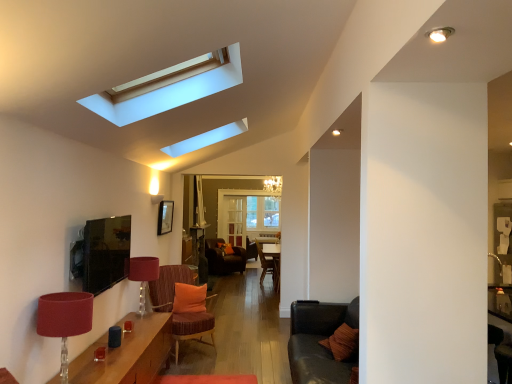
Question: Is velvet orange armchair at center positioned beyond the bounds of matte red lampshade at lower left, arranged as the second lamp when viewed from the front?

Choices:
 (A) yes
 (B) no

Answer: (A)

Question: From the image's perspective, is velvet orange armchair at center located beneath matte red lampshade at lower left, which ranks as the 1th lamp in back-to-front order?

Choices:
 (A) no
 (B) yes

Answer: (B)

Question: Considering the relative positions of velvet orange armchair at center and matte red lampshade at lower left, arranged as the second lamp when viewed from the front, in the image provided, is velvet orange armchair at center behind matte red lampshade at lower left, arranged as the second lamp when viewed from the front,?

Choices:
 (A) yes
 (B) no

Answer: (A)

Question: From a real-world perspective, is velvet orange armchair at center on top of matte red lampshade at lower left, which ranks as the 1th lamp in back-to-front order?

Choices:
 (A) no
 (B) yes

Answer: (A)

Question: Does velvet orange armchair at center have a lesser height compared to matte red lampshade at lower left, arranged as the second lamp when viewed from the front?

Choices:
 (A) yes
 (B) no

Answer: (B)

Question: Looking at their shapes, would you say textured brown couch at lower right is wider or thinner than velvet orange armchair at center?

Choices:
 (A) thin
 (B) wide

Answer: (A)

Question: In terms of size, does textured brown couch at lower right appear bigger or smaller than velvet orange armchair at center?

Choices:
 (A) small
 (B) big

Answer: (A)

Question: Is textured brown couch at lower right to the left or to the right of velvet orange armchair at center in the image?

Choices:
 (A) left
 (B) right

Answer: (B)

Question: From the image's perspective, is textured brown couch at lower right above or below velvet orange armchair at center?

Choices:
 (A) above
 (B) below

Answer: (A)

Question: In terms of width, does velvet orange armchair at center look wider or thinner when compared to orange fabric pillow at center?

Choices:
 (A) thin
 (B) wide

Answer: (B)

Question: Which is correct: velvet orange armchair at center is inside orange fabric pillow at center, or outside of it?

Choices:
 (A) inside
 (B) outside

Answer: (B)

Question: Based on their positions, is velvet orange armchair at center located to the left or right of orange fabric pillow at center?

Choices:
 (A) right
 (B) left

Answer: (A)

Question: Considering the positions of point (274, 284) and point (182, 306), is point (274, 284) closer or farther from the camera than point (182, 306)?

Choices:
 (A) closer
 (B) farther

Answer: (B)

Question: Is wooden table at lower left inside or outside of orange fabric pillow at center?

Choices:
 (A) inside
 (B) outside

Answer: (B)

Question: Considering the relative positions of wooden table at lower left and orange fabric pillow at center in the image provided, is wooden table at lower left to the left or to the right of orange fabric pillow at center?

Choices:
 (A) right
 (B) left

Answer: (B)